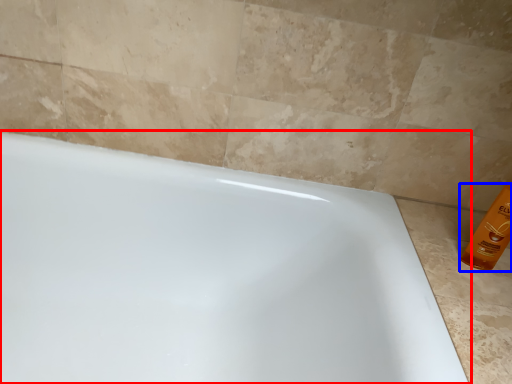
Question: Among these objects, which one is farthest to the camera, bathtub (highlighted by a red box) or cleaning product (highlighted by a blue box)?

Choices:
 (A) bathtub
 (B) cleaning product

Answer: (B)